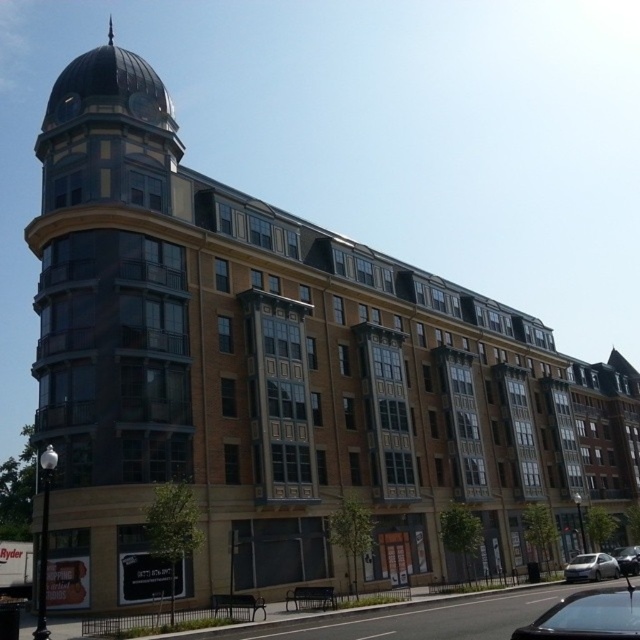
Does satin silver sedan at lower right have a lesser width compared to shiny silver sedan at lower right?

No.

Who is lower down, satin silver sedan at lower right or shiny silver sedan at lower right?

satin silver sedan at lower right is below.

The width and height of the screenshot is (640, 640). In order to click on satin silver sedan at lower right in this screenshot , I will do `click(589, 566)`.

How much distance is there between shiny black car at lower right and shiny silver sedan at lower right?

A distance of 73.59 feet exists between shiny black car at lower right and shiny silver sedan at lower right.

Which is above, shiny black car at lower right or shiny silver sedan at lower right?

shiny black car at lower right

Between point (596, 595) and point (625, 566), which one is positioned behind?

Point (625, 566)

This screenshot has height=640, width=640. In order to click on shiny black car at lower right in this screenshot , I will do `click(588, 616)`.

Is shiny black car at lower right shorter than satin silver sedan at lower right?

In fact, shiny black car at lower right may be taller than satin silver sedan at lower right.

Is the position of shiny black car at lower right more distant than that of satin silver sedan at lower right?

No, it is in front of satin silver sedan at lower right.

Does point (582, 602) lie in front of point (588, 572)?

Yes, it is in front of point (588, 572).

The height and width of the screenshot is (640, 640). I want to click on shiny black car at lower right, so click(x=588, y=616).